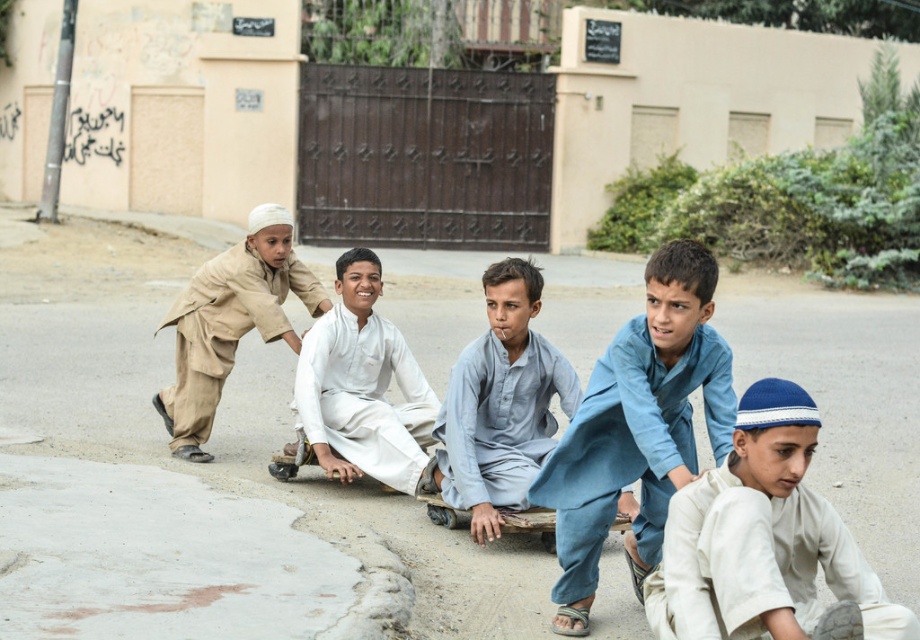
Is the position of white cotton shirt at lower right less distant than that of white cotton shirt at center?

Yes, it is.

Can you confirm if white cotton shirt at lower right is positioned below white cotton shirt at center?

Indeed, white cotton shirt at lower right is positioned under white cotton shirt at center.

Is point (835, 573) farther from camera compared to point (320, 368)?

No, it is in front of (320, 368).

Locate an element on the screen. This screenshot has width=920, height=640. white cotton shirt at lower right is located at coordinates (765, 541).

Between white cotton shirt at lower right and blue cotton shirt at center, which one has more height?

With more height is blue cotton shirt at center.

Can you confirm if white cotton shirt at lower right is positioned above blue cotton shirt at center?

No, white cotton shirt at lower right is not above blue cotton shirt at center.

This screenshot has height=640, width=920. I want to click on white cotton shirt at lower right, so click(x=765, y=541).

The height and width of the screenshot is (640, 920). Find the location of `white cotton shirt at lower right`. white cotton shirt at lower right is located at coordinates (765, 541).

What do you see at coordinates (638, 428) in the screenshot? I see `blue cotton shirt at center` at bounding box center [638, 428].

Does point (566, 465) come in front of point (422, 460)?

Yes.

Find the location of a particular element. This screenshot has height=640, width=920. blue cotton shirt at center is located at coordinates (638, 428).